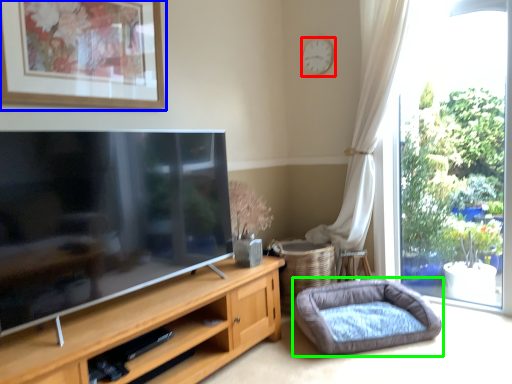
Question: Estimate the real-world distances between objects in this image. Which object is closer to clock (highlighted by a red box), picture frame (highlighted by a blue box) or dog bed (highlighted by a green box)?

Choices:
 (A) picture frame
 (B) dog bed

Answer: (A)